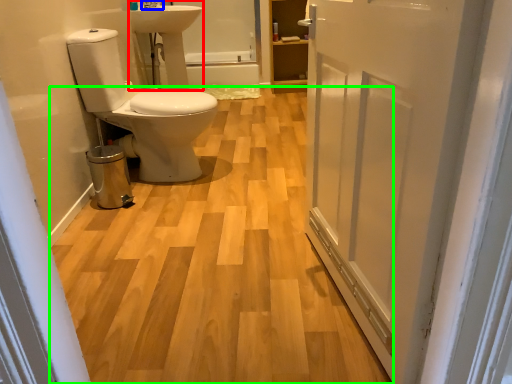
Question: Considering the real-world distances, which object is farthest from sink (highlighted by a red box)? tap (highlighted by a blue box) or plain (highlighted by a green box)?

Choices:
 (A) tap
 (B) plain

Answer: (B)